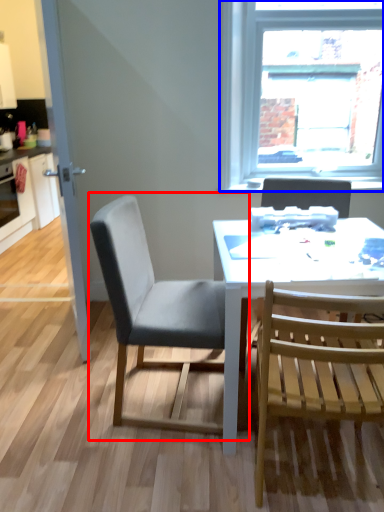
Question: Which object appears closest to the camera in this image, chair (highlighted by a red box) or window (highlighted by a blue box)?

Choices:
 (A) chair
 (B) window

Answer: (A)